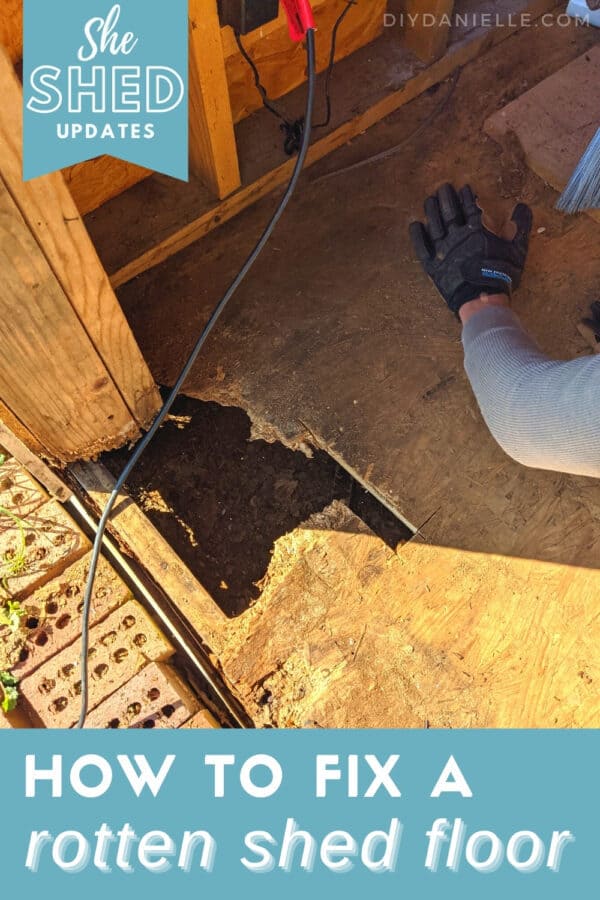
Where is `hole in floor`? hole in floor is located at coordinates (276, 464).